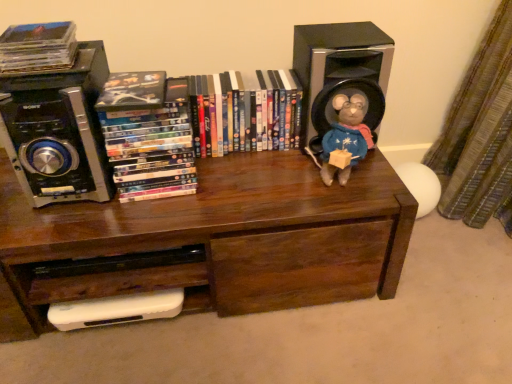
Image resolution: width=512 pixels, height=384 pixels. I want to click on vacant space that is in between black plastic speaker at upper right, arranged as the second speaker when viewed from the left, and matte plastic dvds at center, marked as the first book in a right-to-left arrangement, so click(x=264, y=157).